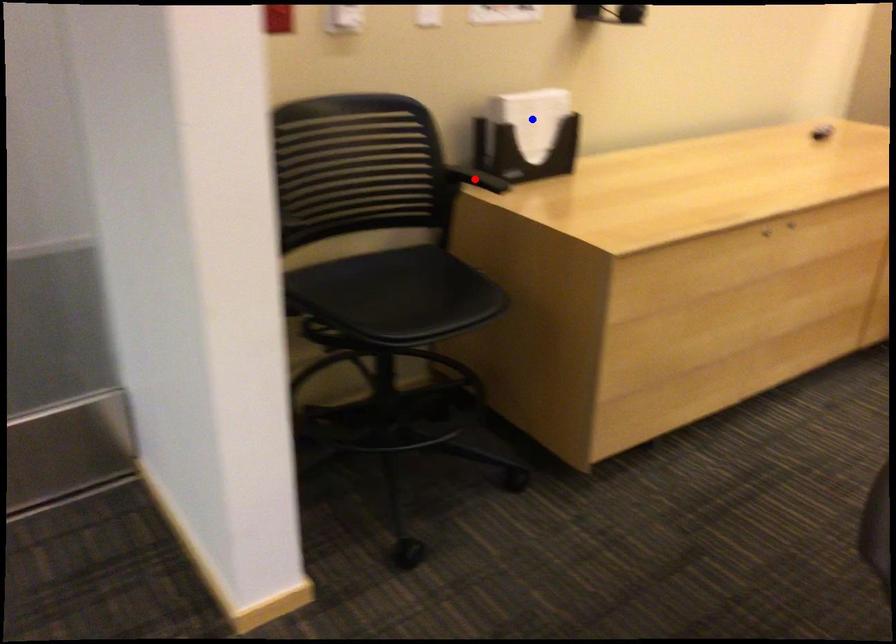
Question: Two points are marked on the image. Which point is closer to the camera?

Choices:
 (A) Blue point is closer.
 (B) Red point is closer.

Answer: (B)